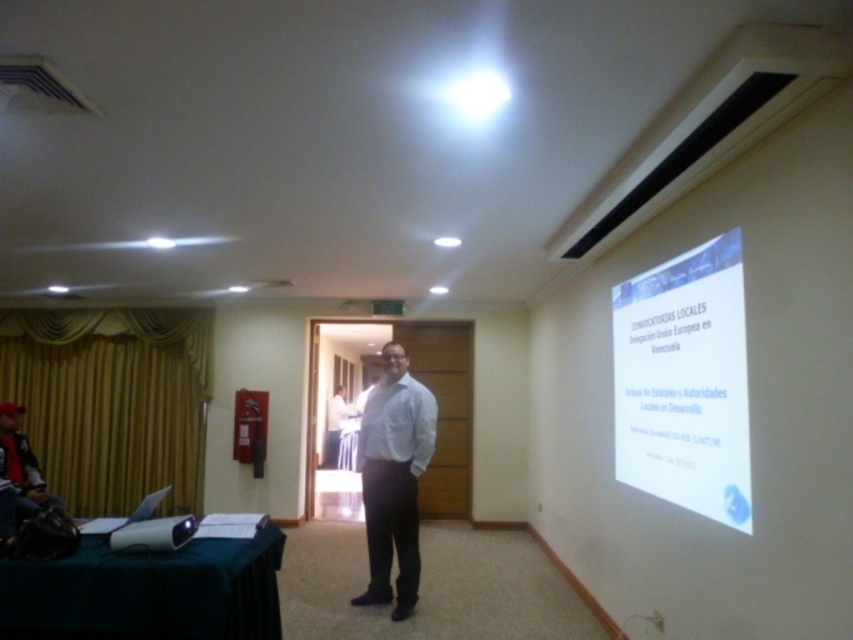
You are attending a presentation in the conference room and notice two attendees wearing a white matte shirt at center and a dark gray jacket at left. Which clothing item is positioned higher in the image?

The white matte shirt at center is taller than the dark gray jacket at left, so the white matte shirt at center is positioned higher in the image.

You are a guest attending a presentation in the conference room. You notice the white matte projector screen at upper right and the dark gray jacket at left. Which object appears narrower in the image?

The white matte projector screen at upper right is thinner than the dark gray jacket at left, so the white matte projector screen at upper right appears narrower.